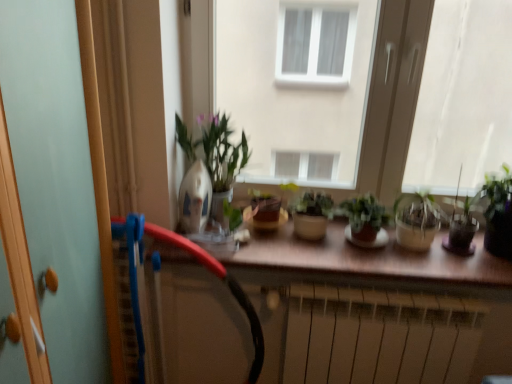
What do you see at coordinates (55, 177) in the screenshot? I see `light blue glass screen door at left` at bounding box center [55, 177].

The height and width of the screenshot is (384, 512). What do you see at coordinates (498, 214) in the screenshot?
I see `translucent glass vase at right, the 4th houseplant in the left-to-right sequence` at bounding box center [498, 214].

Describe the element at coordinates (394, 95) in the screenshot. I see `transparent glass window at center, the second window positioned from the right` at that location.

You are a GUI agent. You are given a task and a screenshot of the screen. Output one action in this format:
    pyautogui.click(x=<x>, y=<y>)
    Task: Click on the black rubber garden hose at center
    This screenshot has height=384, width=512.
    Given the screenshot: What is the action you would take?
    pyautogui.click(x=224, y=281)

From a real-world perspective, is transparent glass window at center, placed as the 1th window when sorted from left to right, physically below light blue glass screen door at left?

No.

How different are the orientations of transparent glass window at center, placed as the 1th window when sorted from left to right, and light blue glass screen door at left in degrees?

There is a 89.9-degree angle between the facing directions of transparent glass window at center, placed as the 1th window when sorted from left to right, and light blue glass screen door at left.

Is transparent glass window at center, placed as the 1th window when sorted from left to right, outside of light blue glass screen door at left?

Yes, transparent glass window at center, placed as the 1th window when sorted from left to right, is located beyond the bounds of light blue glass screen door at left.

Which object is more forward, transparent glass window at center, the second window positioned from the right, or light blue glass screen door at left?

light blue glass screen door at left is closer to the camera.

Is green matte plant pot at center, which is counted as the 1th houseplant, starting from the left, surrounded by translucent glass pot at right, the third houseplant when ordered from left to right?

No, green matte plant pot at center, which is counted as the 1th houseplant, starting from the left, is not inside translucent glass pot at right, the third houseplant when ordered from left to right.

Is the surface of translucent glass pot at right, the third houseplant when ordered from left to right, in direct contact with green matte plant pot at center, which is counted as the 1th houseplant, starting from the left?

translucent glass pot at right, the third houseplant when ordered from left to right, and green matte plant pot at center, which is counted as the 1th houseplant, starting from the left, are clearly separated.

From the image's perspective, between translucent glass pot at right, the 2th houseplant from the right, and green matte plant pot at center, which ranks as the fourth houseplant in right-to-left order, who is located below?

green matte plant pot at center, which ranks as the fourth houseplant in right-to-left order.

The width and height of the screenshot is (512, 384). I want to click on the 2nd houseplant to the right of the green matte plant pot at center, which ranks as the fourth houseplant in right-to-left order, counting from the anchor's position, so click(462, 225).

Could you measure the distance between brown matte counter top at center and transparent glass window at center, the second window positioned from the right?

A distance of 13.37 inches exists between brown matte counter top at center and transparent glass window at center, the second window positioned from the right.

Considering the relative sizes of brown matte counter top at center and transparent glass window at center, placed as the 1th window when sorted from left to right, in the image provided, is brown matte counter top at center bigger than transparent glass window at center, placed as the 1th window when sorted from left to right,?

No.

Between point (385, 271) and point (414, 41), which one is positioned behind?

The point (414, 41) is more distant.

Are brown matte counter top at center and transparent glass window at center, placed as the 1th window when sorted from left to right, far apart?

That's not correct — brown matte counter top at center is a little close to transparent glass window at center, placed as the 1th window when sorted from left to right.

Who is smaller, transparent glass window at center, the second window positioned from the right, or brown matte counter top at center?

brown matte counter top at center.

Considering the positions of point (376, 126) and point (459, 255), is point (376, 126) closer or farther from the camera than point (459, 255)?

Clearly, point (376, 126) is more distant from the camera than point (459, 255).

Considering the sizes of objects transparent glass window at center, placed as the 1th window when sorted from left to right, and brown matte counter top at center in the image provided, who is taller, transparent glass window at center, placed as the 1th window when sorted from left to right, or brown matte counter top at center?

transparent glass window at center, placed as the 1th window when sorted from left to right, is taller.

Is transparent glass window at center, the second window positioned from the right, looking in the opposite direction of brown matte counter top at center?

No, transparent glass window at center, the second window positioned from the right, is not facing away from brown matte counter top at center.

Would you say transparent glass window at center, the second window positioned from the right, is outside green matte plant at center, which is counted as the third houseplant, starting from the right?

transparent glass window at center, the second window positioned from the right, lies outside green matte plant at center, which is counted as the third houseplant, starting from the right,'s area.

Does transparent glass window at center, placed as the 1th window when sorted from left to right, have a lesser height compared to green matte plant at center, which is counted as the third houseplant, starting from the right?

Incorrect, the height of transparent glass window at center, placed as the 1th window when sorted from left to right, does not fall short of that of green matte plant at center, which is counted as the third houseplant, starting from the right.

From a real-world perspective, is transparent glass window at center, the second window positioned from the right, below green matte plant at center, the 2th houseplant viewed from the left?

No, from a real-world perspective, transparent glass window at center, the second window positioned from the right, is not beneath green matte plant at center, the 2th houseplant viewed from the left.

Is light blue glass screen door at left turned away from black rubber garden hose at center?

No.

Measure the distance from light blue glass screen door at left to black rubber garden hose at center.

light blue glass screen door at left and black rubber garden hose at center are 15.42 inches apart.

Between point (28, 148) and point (207, 265), which one is positioned behind?

Positioned behind is point (207, 265).

From the image's perspective, which is below, light blue glass screen door at left or black rubber garden hose at center?

black rubber garden hose at center appears lower in the image.

Which point is more distant from viewer, (380, 251) or (348, 239)?

The point (348, 239) is more distant.

Identify the location of counter top that appears below the green matte plant at center, which is counted as the third houseplant, starting from the right (from the image's perspective). (364, 263).

From a real-world perspective, is brown matte counter top at center positioned above or below green matte plant at center, the 2th houseplant viewed from the left?

From a real-world perspective, brown matte counter top at center is physically below green matte plant at center, the 2th houseplant viewed from the left.

Do you think brown matte counter top at center is within green matte plant at center, the 2th houseplant viewed from the left, or outside of it?

The correct answer is: outside.

At what (x,y) coordinates should I click in order to perform the action: click on screen door below the transparent glass window at center, placed as the 1th window when sorted from left to right (from the image's perspective). Please return your answer as a coordinate pair (x, y). Looking at the image, I should click on (55, 177).

Find the location of a particular element. The height and width of the screenshot is (384, 512). the 2nd houseplant counting from the left side of the translucent glass pot at right, the third houseplant when ordered from left to right is located at coordinates (311, 214).

Considering their positions, is light blue glass screen door at left positioned closer to green matte plant pot at center, which is counted as the 1th houseplant, starting from the left, than translucent glass vase at right, the 4th houseplant in the left-to-right sequence?

translucent glass vase at right, the 4th houseplant in the left-to-right sequence.

From the image, which object appears to be nearer to green matte plant at center, the 2th houseplant viewed from the left, light blue glass screen door at left or transparent glass window at right, arranged as the 1th window when viewed from the right?

light blue glass screen door at left is closer to green matte plant at center, the 2th houseplant viewed from the left.

Based on their spatial positions, is transparent glass window at center, the second window positioned from the right, or brown matte counter top at center further from translucent glass vase at right, acting as the first houseplant starting from the right?

transparent glass window at center, the second window positioned from the right, is further to translucent glass vase at right, acting as the first houseplant starting from the right.

Looking at the image, which one is located further to black rubber garden hose at center, light blue glass screen door at left or green matte plant at center, which is counted as the third houseplant, starting from the right?

green matte plant at center, which is counted as the third houseplant, starting from the right, lies further to black rubber garden hose at center than the other object.

Which object lies further to the anchor point black rubber garden hose at center, translucent glass pot at right, the third houseplant when ordered from left to right, or green matte plant at center, the 2th houseplant viewed from the left?

Based on the image, translucent glass pot at right, the third houseplant when ordered from left to right, appears to be further to black rubber garden hose at center.

Based on their spatial positions, is translucent glass pot at right, the third houseplant when ordered from left to right, or black rubber garden hose at center closer to green matte plant at center, the 2th houseplant viewed from the left?

translucent glass pot at right, the third houseplant when ordered from left to right.

From the picture: Looking at the image, which one is located further to translucent glass pot at right, the 2th houseplant from the right, light blue glass screen door at left or brown matte counter top at center?

Among the two, light blue glass screen door at left is located further to translucent glass pot at right, the 2th houseplant from the right.

Consider the image. Looking at the image, which one is located further to green matte plant pot at center, which is counted as the 1th houseplant, starting from the left, brown matte counter top at center or translucent glass pot at right, the 2th houseplant from the right?

Based on the image, translucent glass pot at right, the 2th houseplant from the right, appears to be further to green matte plant pot at center, which is counted as the 1th houseplant, starting from the left.

You are a GUI agent. You are given a task and a screenshot of the screen. Output one action in this format:
    pyautogui.click(x=<x>, y=<y>)
    Task: Click on the window situated between black rubber garden hose at center and translucent glass pot at right, the third houseplant when ordered from left to right, from left to right
    This screenshot has height=384, width=512.
    Given the screenshot: What is the action you would take?
    pyautogui.click(x=394, y=95)

At what (x,y) coordinates should I click in order to perform the action: click on counter top between black rubber garden hose at center and translucent glass pot at right, the third houseplant when ordered from left to right. Please return your answer as a coordinate pair (x, y). This screenshot has width=512, height=384. Looking at the image, I should click on (364, 263).

In order to click on counter top between green matte plant pot at center, which ranks as the fourth houseplant in right-to-left order, and translucent glass pot at right, the 2th houseplant from the right in this screenshot , I will do `click(364, 263)`.

Locate an element on the screen. houseplant between brown matte counter top at center and translucent glass pot at right, the 2th houseplant from the right, from left to right is located at coordinates (365, 221).